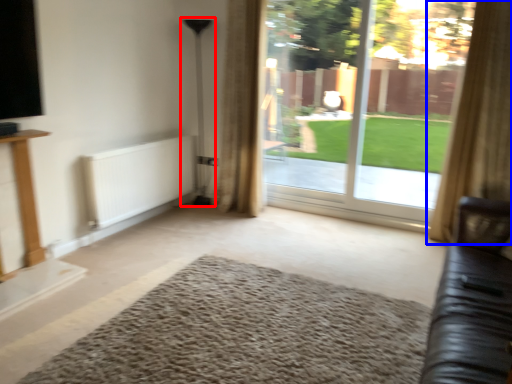
Question: Which of the following is the closest to the observer, lamp (highlighted by a red box) or curtain (highlighted by a blue box)?

Choices:
 (A) lamp
 (B) curtain

Answer: (B)